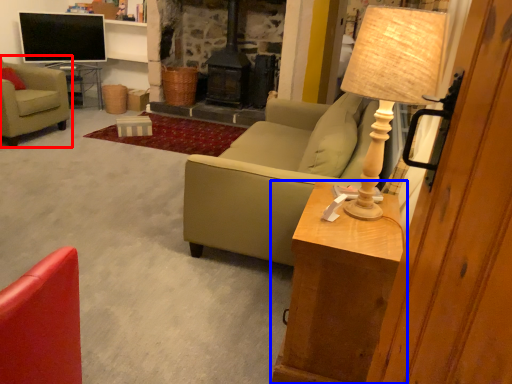
Question: Which object appears farthest to the camera in this image, chair (highlighted by a red box) or table (highlighted by a blue box)?

Choices:
 (A) chair
 (B) table

Answer: (A)